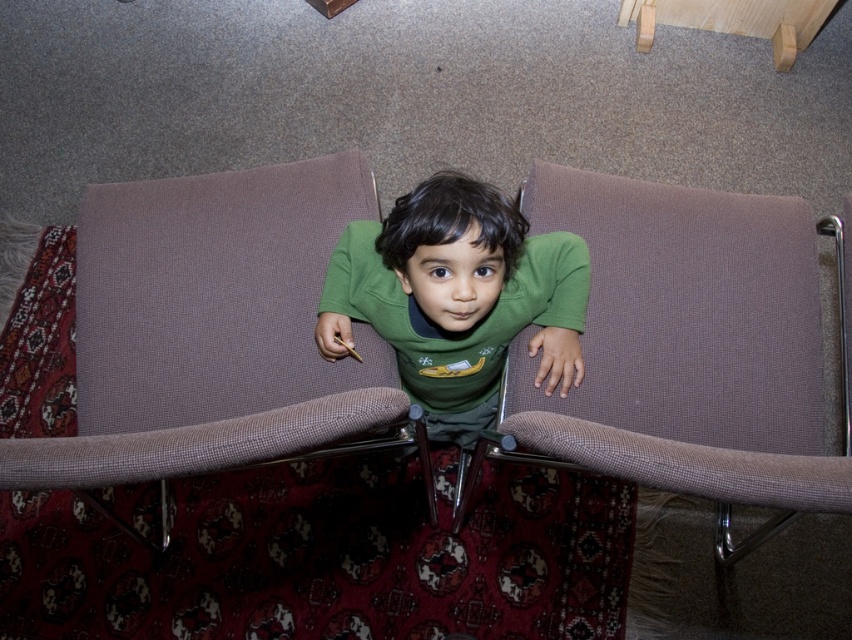
Question: Which object appears farthest from the camera in this image?

Choices:
 (A) brown fabric couch at left
 (B) green matte shirt at center

Answer: (B)

Question: Does brown fabric couch at center appear over green matte shirt at center?

Choices:
 (A) no
 (B) yes

Answer: (A)

Question: Does brown fabric couch at left have a smaller size compared to brown fabric couch at center?

Choices:
 (A) no
 (B) yes

Answer: (B)

Question: Which of the following is the closest to the observer?

Choices:
 (A) (602, 225)
 (B) (465, 189)
 (C) (158, 401)

Answer: (B)

Question: Where is brown fabric couch at center located in relation to green matte shirt at center in the image?

Choices:
 (A) left
 (B) right

Answer: (B)

Question: Which point is farther to the camera?

Choices:
 (A) brown fabric couch at left
 (B) brown fabric couch at center

Answer: (A)